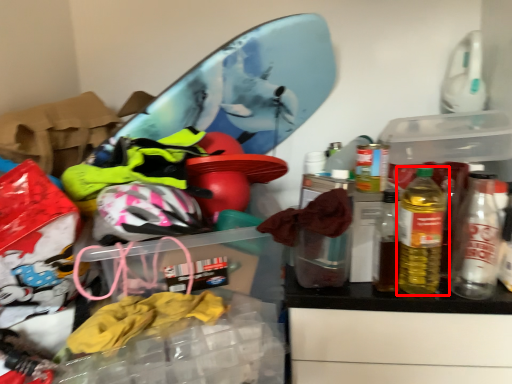
Question: From the image's perspective, what is the correct spatial positioning of bottle (annotated by the red box) in reference to bottle?

Choices:
 (A) above
 (B) below

Answer: (A)